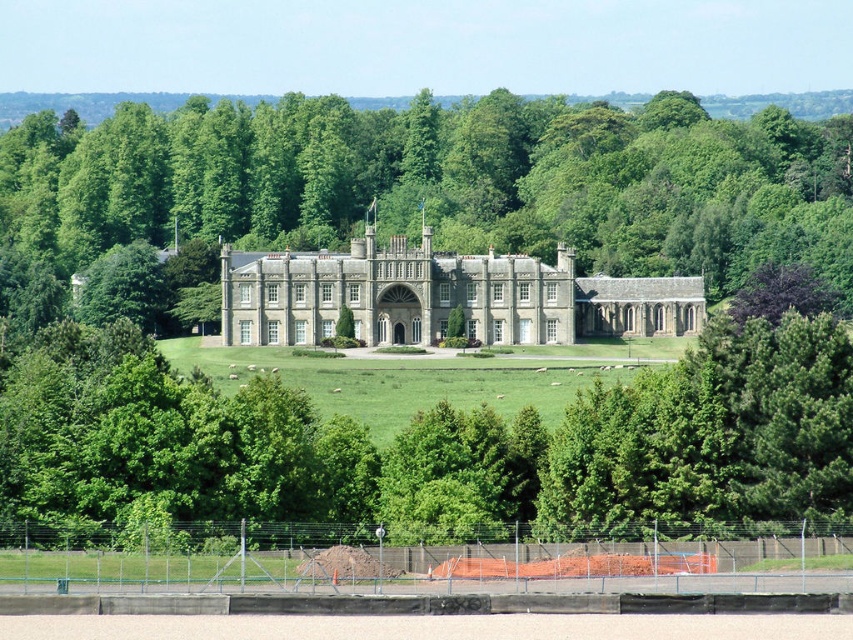
Question: Which of the following is the closest to the observer?

Choices:
 (A) (566, 193)
 (B) (477, 330)

Answer: (B)

Question: Can you confirm if green leafy tree at center is positioned below gray stone palace at center?

Choices:
 (A) yes
 (B) no

Answer: (B)

Question: Which point appears closest to the camera in this image?

Choices:
 (A) (534, 323)
 (B) (788, 253)

Answer: (A)

Question: Is green leafy tree at center to the left of gray stone palace at center from the viewer's perspective?

Choices:
 (A) yes
 (B) no

Answer: (A)

Question: Does green leafy tree at center appear on the right side of gray stone palace at center?

Choices:
 (A) yes
 (B) no

Answer: (B)